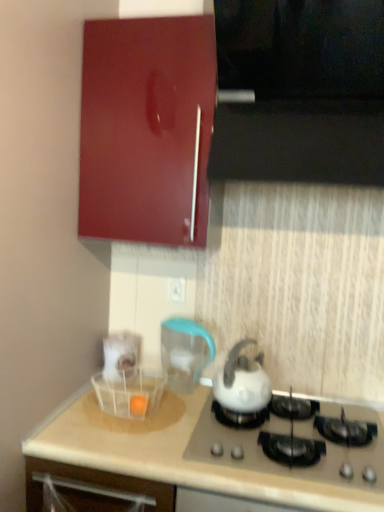
This screenshot has width=384, height=512. I want to click on vacant space underneath black glossy vent at upper center (from a real-world perspective), so click(x=290, y=429).